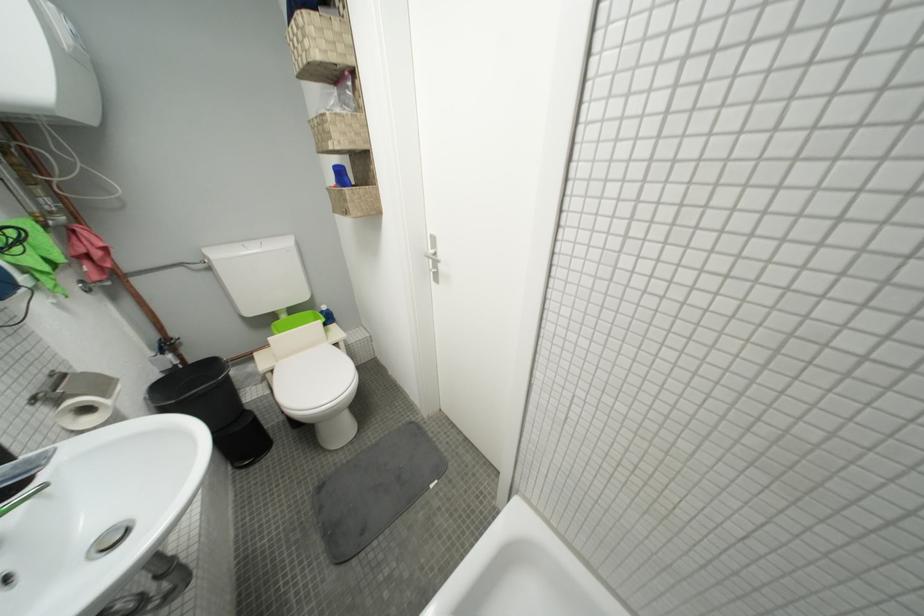
The width and height of the screenshot is (924, 616). Describe the element at coordinates (432, 254) in the screenshot. I see `the silver door handle` at that location.